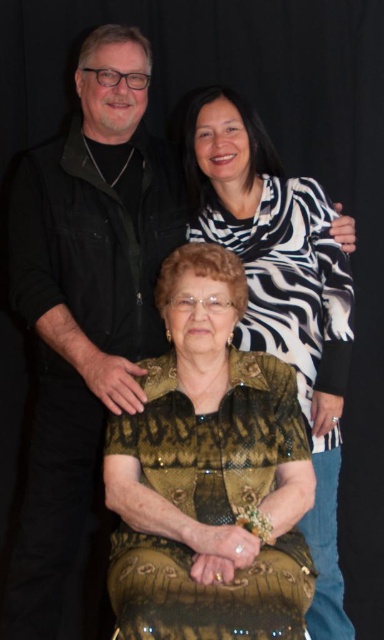
Question: Which point is farther to the camera?

Choices:
 (A) gold textured dress at center
 (B) matte black vest at upper left

Answer: (A)

Question: Does gold textured blouse at center have a lesser width compared to matte black vest at upper left?

Choices:
 (A) yes
 (B) no

Answer: (B)

Question: Is gold textured blouse at center above gold textured dress at center?

Choices:
 (A) no
 (B) yes

Answer: (A)

Question: Among these objects, which one is nearest to the camera?

Choices:
 (A) matte black vest at upper left
 (B) gold textured blouse at center
 (C) gold textured dress at center

Answer: (B)

Question: Which of the following is the farthest from the observer?

Choices:
 (A) (319, 467)
 (B) (192, 257)

Answer: (A)

Question: Is gold textured blouse at center further to the viewer compared to matte black vest at upper left?

Choices:
 (A) yes
 (B) no

Answer: (B)